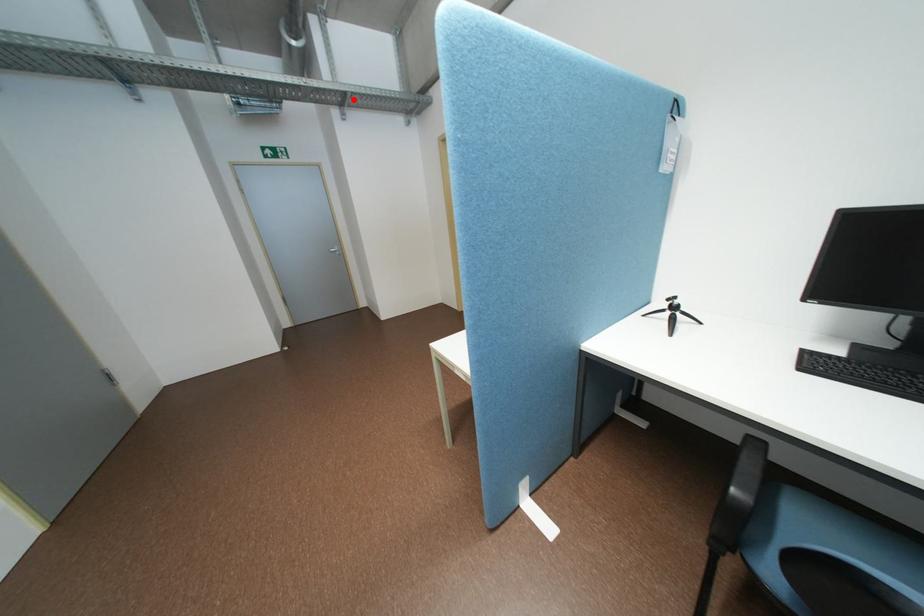
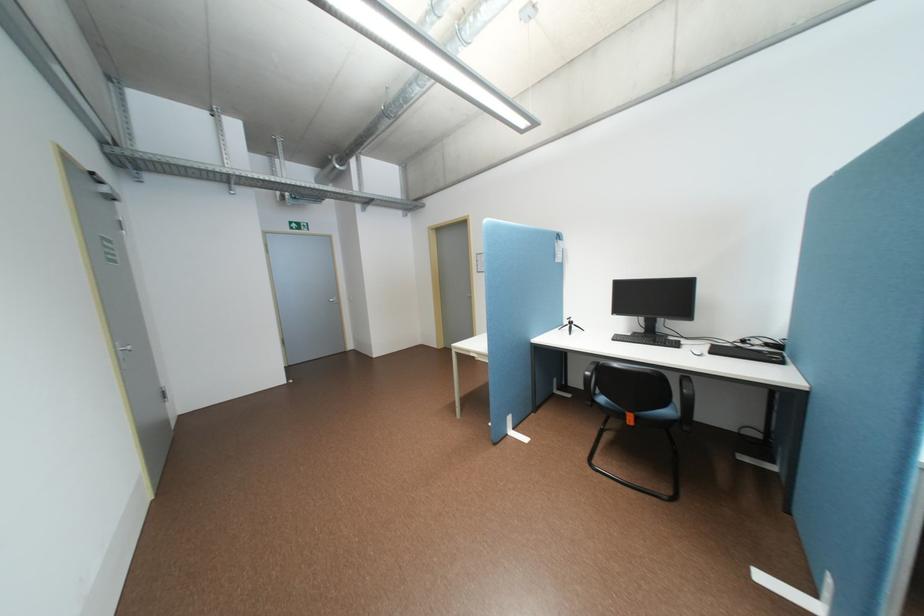
In the second image, find the point that corresponds to the highlighted location in the first image.

(379, 201)